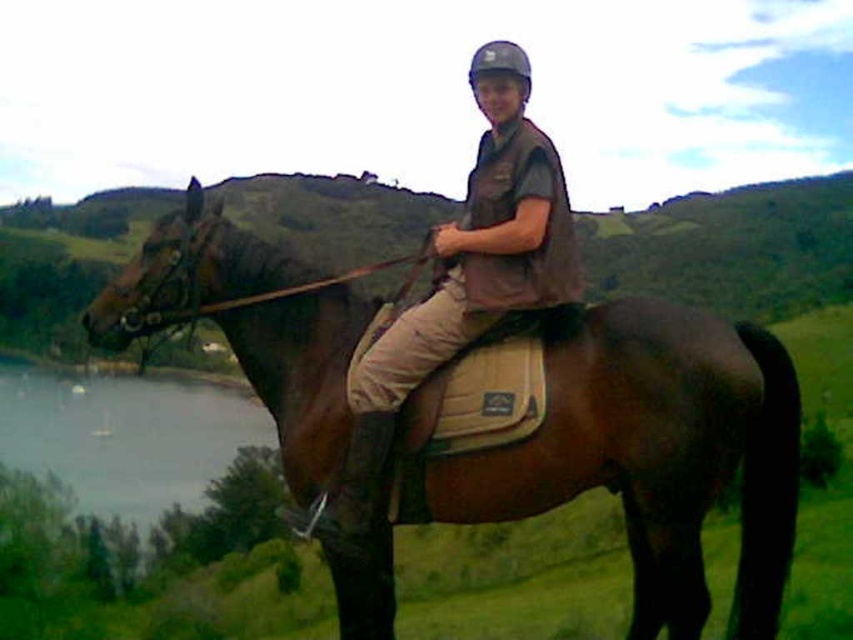
Question: Which of the following is the farthest from the observer?

Choices:
 (A) brown leather saddle at center
 (B) grayish water at lower left
 (C) brown leather horse at center
 (D) brown leather vest at center

Answer: (B)

Question: Can you confirm if brown leather saddle at center is thinner than brown leather vest at center?

Choices:
 (A) yes
 (B) no

Answer: (B)

Question: Which point is farther from the camera taking this photo?

Choices:
 (A) (120, 236)
 (B) (502, 198)
 (C) (236, 433)
 (D) (693, 564)

Answer: (C)

Question: Considering the relative positions of brown leather horse at center and grayish water at lower left in the image provided, where is brown leather horse at center located with respect to grayish water at lower left?

Choices:
 (A) left
 (B) right

Answer: (B)

Question: Does brown leather horse at center have a greater width compared to brown leather vest at center?

Choices:
 (A) no
 (B) yes

Answer: (B)

Question: Estimate the real-world distances between objects in this image. Which object is closer to the brown leather saddle at center?

Choices:
 (A) brown leather vest at center
 (B) grayish water at lower left

Answer: (A)